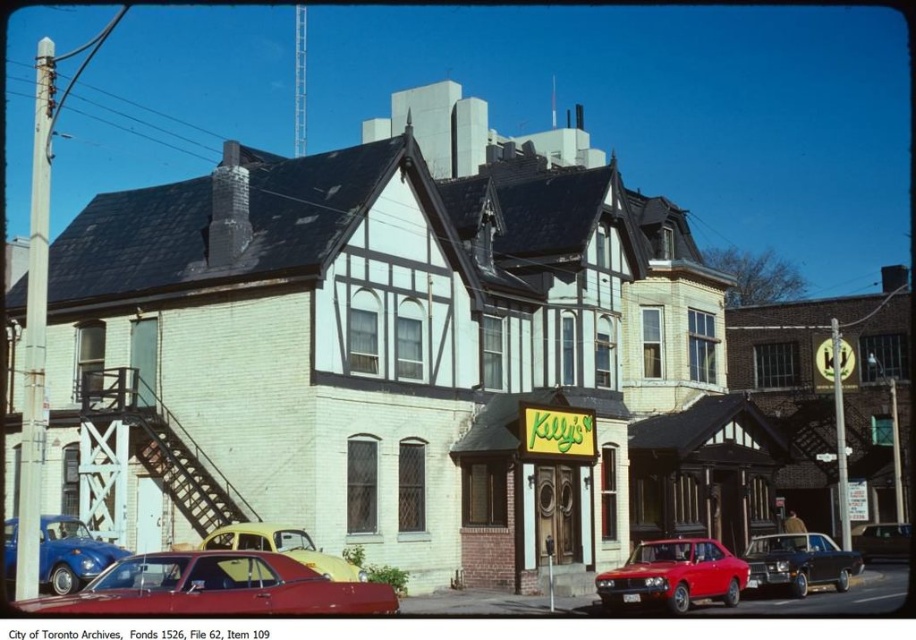
Question: Can you confirm if glossy red car at lower left is positioned below matte blue car at lower left?

Choices:
 (A) yes
 (B) no

Answer: (B)

Question: Among these points, which one is nearest to the camera?

Choices:
 (A) (585, 433)
 (B) (867, 528)

Answer: (A)

Question: Which point is farther to the camera?

Choices:
 (A) matte red sedan at center
 (B) yellow signboard at center

Answer: (B)

Question: Which object is positioned farthest from the yellow matte car at center?

Choices:
 (A) metallic silver sedan at center
 (B) shiny black sedan at center

Answer: (A)

Question: Is glossy red car at lower left to the left of yellow matte car at center from the viewer's perspective?

Choices:
 (A) yes
 (B) no

Answer: (A)

Question: Can you confirm if matte red sedan at center is positioned to the right of yellow matte car at center?

Choices:
 (A) no
 (B) yes

Answer: (B)